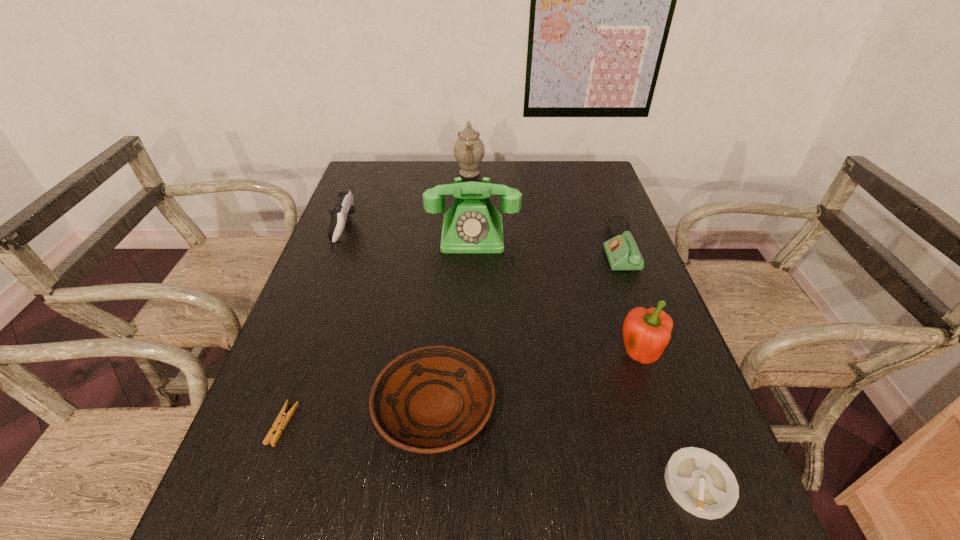
You are a GUI agent. You are given a task and a screenshot of the screen. Output one action in this format:
    pyautogui.click(x=<x>, y=<y>)
    Task: Click on the vacant space situated 0.370m on the dial of the taller telephone
    
    Given the screenshot: What is the action you would take?
    pyautogui.click(x=470, y=359)

Locate an element on the screen. This screenshot has height=540, width=960. vacant space situated 0.050m on the left of the pepper is located at coordinates (594, 357).

Where is `vacant space situated 0.310m on the front-facing side of the fifth shortest object`? The image size is (960, 540). vacant space situated 0.310m on the front-facing side of the fifth shortest object is located at coordinates (458, 228).

Where is `vacant region located 0.360m on the dial of the right telephone`? The width and height of the screenshot is (960, 540). vacant region located 0.360m on the dial of the right telephone is located at coordinates (477, 247).

At what (x,y) coordinates should I click in order to perform the action: click on vacant space located on the dial of the right telephone. Please return your answer as a coordinate pair (x, y). Image resolution: width=960 pixels, height=540 pixels. Looking at the image, I should click on (464, 247).

Where is `vacant area located on the dial of the right telephone`? The width and height of the screenshot is (960, 540). vacant area located on the dial of the right telephone is located at coordinates (516, 247).

I want to click on free spot located 0.220m on the left of the third shortest object, so [x=265, y=408].

Locate an element on the screen. This screenshot has width=960, height=540. vacant space located on the back of the ashtray is located at coordinates (648, 343).

I want to click on free spot located 0.100m on the right of the clothespin, so click(x=345, y=424).

The width and height of the screenshot is (960, 540). I want to click on object at the far edge, so click(x=469, y=150).